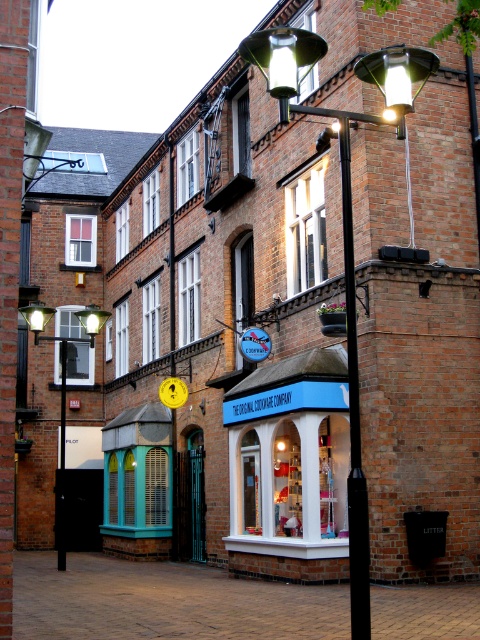
Question: Among these objects, which one is nearest to the camera?

Choices:
 (A) matte black street light at upper center
 (B) black metal pole at center
 (C) matte black street light at upper left

Answer: (B)

Question: Is matte blue storefront at center to the right of matte black street light at upper center from the viewer's perspective?

Choices:
 (A) no
 (B) yes

Answer: (A)

Question: Is matte black street light at upper center below black metal pole at center?

Choices:
 (A) no
 (B) yes

Answer: (A)

Question: Which object is closer to the camera taking this photo?

Choices:
 (A) matte blue storefront at center
 (B) brown brick pavement at lower center

Answer: (B)

Question: Is brown brick pavement at lower center above matte black street light at upper left?

Choices:
 (A) yes
 (B) no

Answer: (B)

Question: Which is nearer to the black metal pole at center?

Choices:
 (A) matte blue storefront at center
 (B) brown brick pavement at lower center
 (C) matte black street light at upper left

Answer: (B)